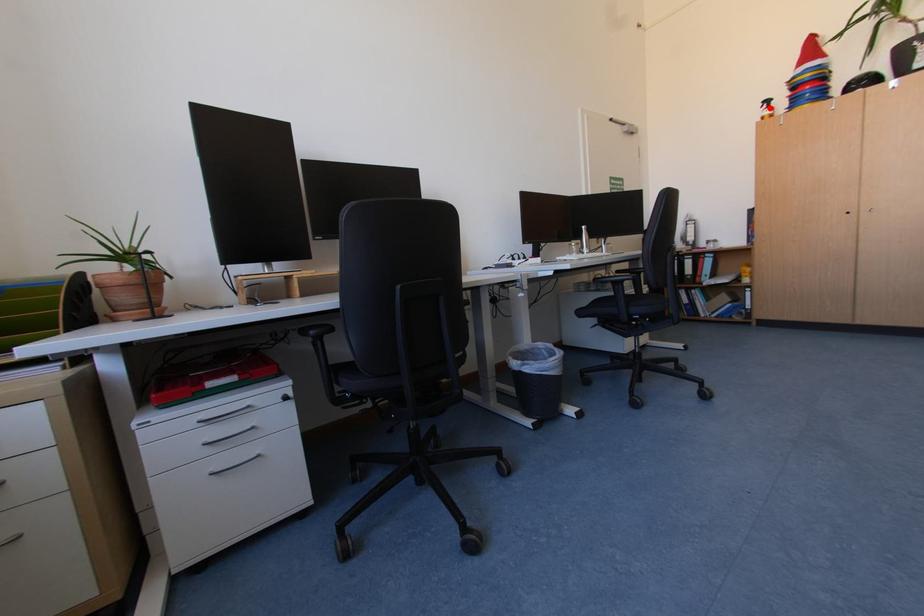
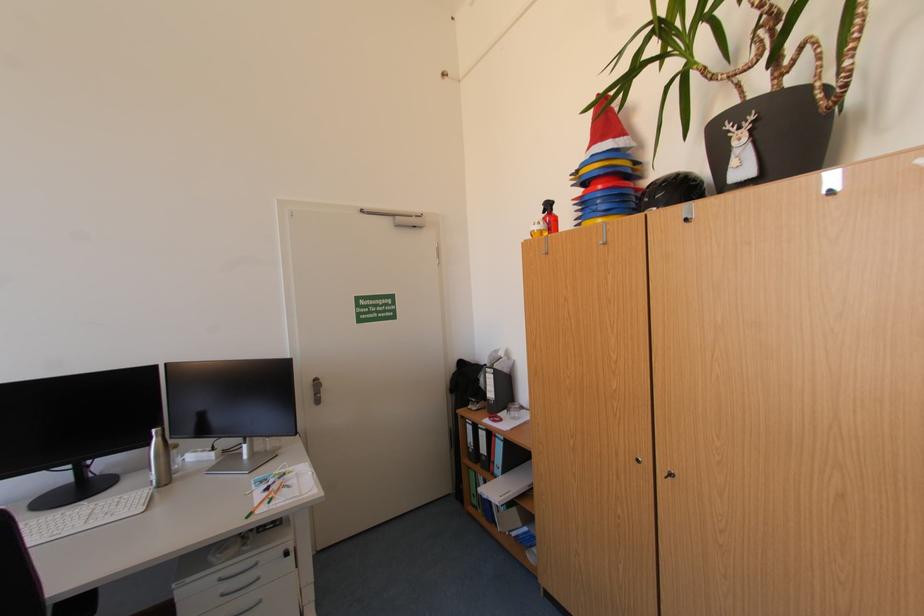
In the second image, find the point that corresponds to the highlighted location in the first image.

(552, 213)